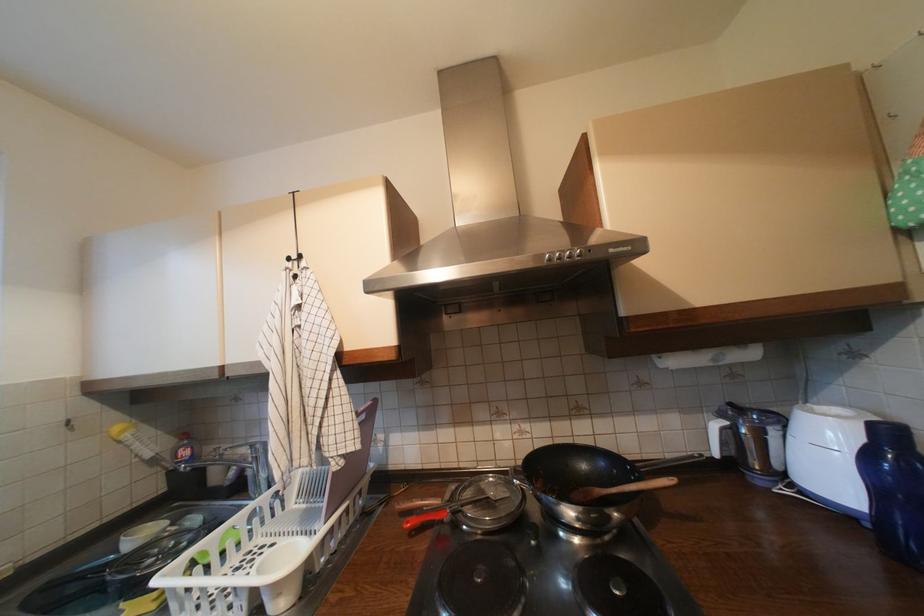
Locate an element on the screen. white kettle handle is located at coordinates (728, 440).